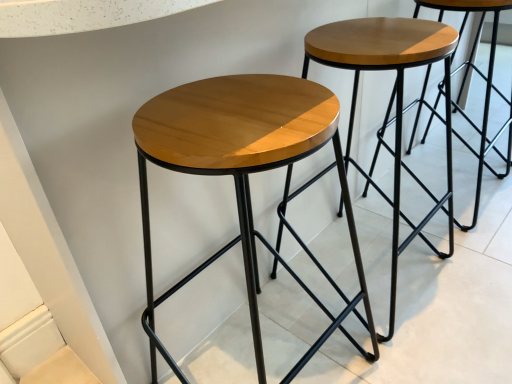
The image size is (512, 384). I want to click on shiny wood stool at center, acting as the second stool starting from the right, so click(x=243, y=175).

Based on the photo, how much space does shiny wood stool at center, acting as the second stool starting from the right, occupy vertically?

shiny wood stool at center, acting as the second stool starting from the right, is 28.07 inches in height.

What do you see at coordinates (243, 175) in the screenshot? The width and height of the screenshot is (512, 384). I see `shiny wood stool at center, acting as the second stool starting from the right` at bounding box center [243, 175].

How much space does wooden stool at center, placed as the first stool when sorted from right to left, occupy vertically?

The height of wooden stool at center, placed as the first stool when sorted from right to left, is 28.06 inches.

Where is `wooden stool at center, the 2th stool in the left-to-right sequence`? wooden stool at center, the 2th stool in the left-to-right sequence is located at coordinates point(397,99).

What do you see at coordinates (397, 99) in the screenshot? The image size is (512, 384). I see `wooden stool at center, placed as the first stool when sorted from right to left` at bounding box center [397, 99].

Image resolution: width=512 pixels, height=384 pixels. I want to click on shiny wood stool at center, acting as the second stool starting from the right, so click(x=243, y=175).

Is wooden stool at center, placed as the first stool when sorted from right to left, at the right side of shiny wood stool at center, which ranks as the 1th stool in left-to-right order?

Correct, you'll find wooden stool at center, placed as the first stool when sorted from right to left, to the right of shiny wood stool at center, which ranks as the 1th stool in left-to-right order.

Is wooden stool at center, placed as the first stool when sorted from right to left, positioned behind shiny wood stool at center, acting as the second stool starting from the right?

Yes, wooden stool at center, placed as the first stool when sorted from right to left, is behind shiny wood stool at center, acting as the second stool starting from the right.

Is point (397, 184) more distant than point (239, 155)?

Yes.

From the image's perspective, who appears lower, wooden stool at center, placed as the first stool when sorted from right to left, or shiny wood stool at center, which ranks as the 1th stool in left-to-right order?

shiny wood stool at center, which ranks as the 1th stool in left-to-right order, is shown below in the image.

From a real-world perspective, does wooden stool at center, the 2th stool in the left-to-right sequence, stand above shiny wood stool at center, acting as the second stool starting from the right?

No.

Considering the sizes of objects wooden stool at center, the 2th stool in the left-to-right sequence, and shiny wood stool at center, which ranks as the 1th stool in left-to-right order, in the image provided, who is wider, wooden stool at center, the 2th stool in the left-to-right sequence, or shiny wood stool at center, which ranks as the 1th stool in left-to-right order,?

shiny wood stool at center, which ranks as the 1th stool in left-to-right order, is wider.

In the scene shown: Who is taller, wooden stool at center, the 2th stool in the left-to-right sequence, or shiny wood stool at center, which ranks as the 1th stool in left-to-right order?

Standing taller between the two is shiny wood stool at center, which ranks as the 1th stool in left-to-right order.

Based on the photo, which of these two, wooden stool at center, placed as the first stool when sorted from right to left, or shiny wood stool at center, acting as the second stool starting from the right, is bigger?

shiny wood stool at center, acting as the second stool starting from the right.

Is shiny wood stool at center, acting as the second stool starting from the right, a part of wooden stool at center, the 2th stool in the left-to-right sequence?

No, shiny wood stool at center, acting as the second stool starting from the right, is not surrounded by wooden stool at center, the 2th stool in the left-to-right sequence.

Is wooden stool at center, the 2th stool in the left-to-right sequence, next to shiny wood stool at center, which ranks as the 1th stool in left-to-right order, and touching it?

No, wooden stool at center, the 2th stool in the left-to-right sequence, is not touching shiny wood stool at center, which ranks as the 1th stool in left-to-right order.

Is wooden stool at center, placed as the first stool when sorted from right to left, facing away from shiny wood stool at center, which ranks as the 1th stool in left-to-right order?

No, wooden stool at center, placed as the first stool when sorted from right to left, is not facing away from shiny wood stool at center, which ranks as the 1th stool in left-to-right order.

How many degrees apart are the facing directions of wooden stool at center, the 2th stool in the left-to-right sequence, and shiny wood stool at center, which ranks as the 1th stool in left-to-right order?

The facing directions of wooden stool at center, the 2th stool in the left-to-right sequence, and shiny wood stool at center, which ranks as the 1th stool in left-to-right order, are 0.000201 degrees apart.

Locate an element on the screen. The width and height of the screenshot is (512, 384). stool lying below the wooden stool at center, the 2th stool in the left-to-right sequence (from the image's perspective) is located at coordinates (243, 175).

Which object is positioned more to the left, shiny wood stool at center, which ranks as the 1th stool in left-to-right order, or wooden stool at center, the 2th stool in the left-to-right sequence?

shiny wood stool at center, which ranks as the 1th stool in left-to-right order.

Does shiny wood stool at center, which ranks as the 1th stool in left-to-right order, come behind wooden stool at center, placed as the first stool when sorted from right to left?

No, the depth of shiny wood stool at center, which ranks as the 1th stool in left-to-right order, is less than that of wooden stool at center, placed as the first stool when sorted from right to left.

Between point (298, 131) and point (331, 57), which one is positioned in front?

The point (298, 131) is closer.

From the image's perspective, is shiny wood stool at center, which ranks as the 1th stool in left-to-right order, located beneath wooden stool at center, placed as the first stool when sorted from right to left?

Yes, from the image's perspective, shiny wood stool at center, which ranks as the 1th stool in left-to-right order, is below wooden stool at center, placed as the first stool when sorted from right to left.

From a real-world perspective, is shiny wood stool at center, which ranks as the 1th stool in left-to-right order, located beneath wooden stool at center, the 2th stool in the left-to-right sequence?

Incorrect, from a real-world perspective, shiny wood stool at center, which ranks as the 1th stool in left-to-right order, is higher than wooden stool at center, the 2th stool in the left-to-right sequence.

Considering the sizes of objects shiny wood stool at center, which ranks as the 1th stool in left-to-right order, and wooden stool at center, placed as the first stool when sorted from right to left, in the image provided, who is wider, shiny wood stool at center, which ranks as the 1th stool in left-to-right order, or wooden stool at center, placed as the first stool when sorted from right to left,?

Wider between the two is shiny wood stool at center, which ranks as the 1th stool in left-to-right order.

Considering the sizes of objects shiny wood stool at center, which ranks as the 1th stool in left-to-right order, and wooden stool at center, the 2th stool in the left-to-right sequence, in the image provided, who is shorter, shiny wood stool at center, which ranks as the 1th stool in left-to-right order, or wooden stool at center, the 2th stool in the left-to-right sequence,?

wooden stool at center, the 2th stool in the left-to-right sequence, is shorter.

Between shiny wood stool at center, acting as the second stool starting from the right, and wooden stool at center, the 2th stool in the left-to-right sequence, which one has larger size?

shiny wood stool at center, acting as the second stool starting from the right.

Could wooden stool at center, the 2th stool in the left-to-right sequence, be considered to be inside shiny wood stool at center, which ranks as the 1th stool in left-to-right order?

That's incorrect, wooden stool at center, the 2th stool in the left-to-right sequence, is not inside shiny wood stool at center, which ranks as the 1th stool in left-to-right order.

Is there a large distance between shiny wood stool at center, acting as the second stool starting from the right, and wooden stool at center, the 2th stool in the left-to-right sequence?

No, shiny wood stool at center, acting as the second stool starting from the right, is not far away from wooden stool at center, the 2th stool in the left-to-right sequence.

Is shiny wood stool at center, which ranks as the 1th stool in left-to-right order, positioned with its back to wooden stool at center, placed as the first stool when sorted from right to left?

That's not correct — shiny wood stool at center, which ranks as the 1th stool in left-to-right order, is not looking away from wooden stool at center, placed as the first stool when sorted from right to left.

How different are the orientations of shiny wood stool at center, which ranks as the 1th stool in left-to-right order, and wooden stool at center, the 2th stool in the left-to-right sequence, in degrees?

They differ by 0.000201 degrees in their facing directions.

Could you measure the distance between shiny wood stool at center, acting as the second stool starting from the right, and wooden stool at center, the 2th stool in the left-to-right sequence?

shiny wood stool at center, acting as the second stool starting from the right, and wooden stool at center, the 2th stool in the left-to-right sequence, are 10.77 inches apart from each other.

In order to click on stool in front of the wooden stool at center, the 2th stool in the left-to-right sequence in this screenshot , I will do `click(243, 175)`.

Identify the location of stool located underneath the shiny wood stool at center, acting as the second stool starting from the right (from a real-world perspective). This screenshot has height=384, width=512. (397, 99).

Where is `stool below the wooden stool at center, placed as the first stool when sorted from right to left (from the image's perspective)`? stool below the wooden stool at center, placed as the first stool when sorted from right to left (from the image's perspective) is located at coordinates (243, 175).